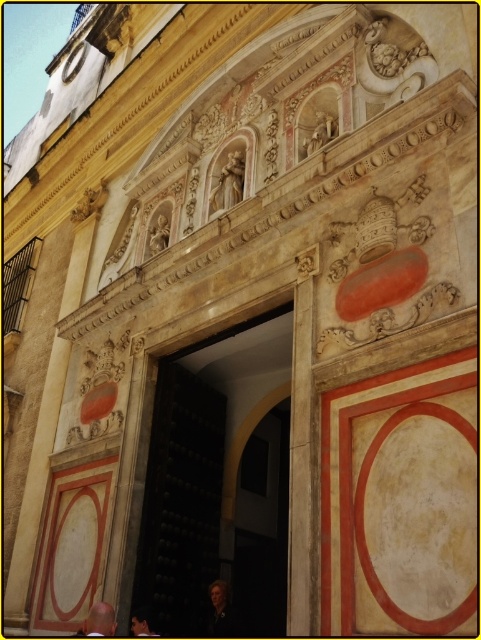
Which is in front, point (218, 378) or point (146, 628)?

Positioned in front is point (146, 628).

Does point (269, 506) come farther from viewer compared to point (136, 612)?

Yes.

This screenshot has height=640, width=481. Find the location of `dark wood door at center`. dark wood door at center is located at coordinates (218, 483).

Can you confirm if light brown leather jacket at center is smaller than dark brown leather jacket at lower left?

No.

Can you confirm if light brown leather jacket at center is positioned below dark brown leather jacket at lower left?

Yes, light brown leather jacket at center is below dark brown leather jacket at lower left.

Does point (106, 620) come behind point (157, 634)?

No, (106, 620) is closer to viewer.

Locate an element on the screen. This screenshot has height=640, width=481. light brown leather jacket at center is located at coordinates (100, 620).

The image size is (481, 640). Describe the element at coordinates (218, 483) in the screenshot. I see `dark wood door at center` at that location.

Between dark wood door at center and light brown leather jacket at center, which one appears on the left side from the viewer's perspective?

light brown leather jacket at center

Does point (282, 518) come behind point (110, 625)?

That is True.

Identify the location of dark wood door at center. The height and width of the screenshot is (640, 481). (218, 483).